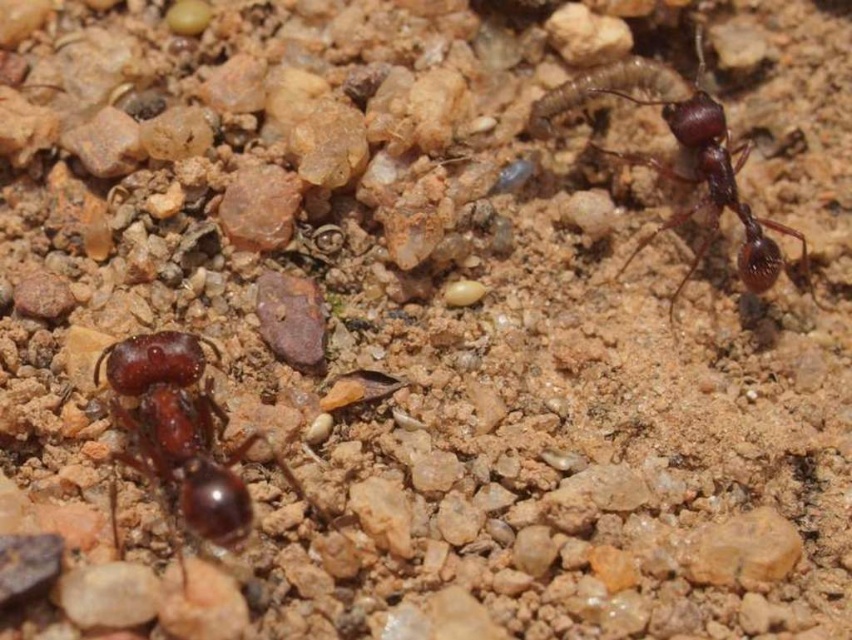
Is shiny dark brown ant at lower left in front of shiny dark brown ant at upper right?

Yes, shiny dark brown ant at lower left is in front of shiny dark brown ant at upper right.

Which is below, shiny dark brown ant at lower left or shiny dark brown ant at upper right?

Positioned lower is shiny dark brown ant at lower left.

What do you see at coordinates (181, 435) in the screenshot? I see `shiny dark brown ant at lower left` at bounding box center [181, 435].

This screenshot has width=852, height=640. In order to click on shiny dark brown ant at lower left in this screenshot , I will do `click(181, 435)`.